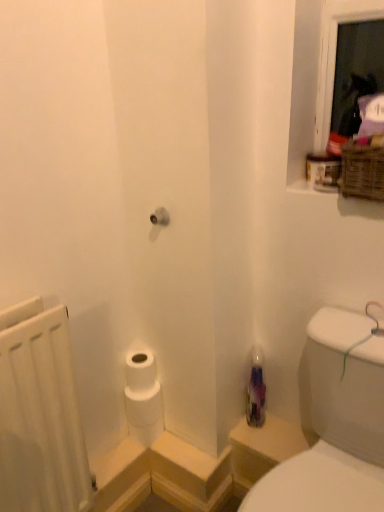
Question: In the image, is transparent plastic bottle at lower right positioned in front of or behind white matte radiator at left?

Choices:
 (A) front
 (B) behind

Answer: (A)

Question: From their relative heights in the image, would you say transparent plastic bottle at lower right is taller or shorter than white matte radiator at left?

Choices:
 (A) short
 (B) tall

Answer: (B)

Question: Which object is positioned closest to the woven brown basket at upper right?

Choices:
 (A) white matte radiator at left
 (B) transparent plastic bottle at lower right
 (C) translucent purple bottle at lower right
 (D) white matte toilet paper at lower left

Answer: (B)

Question: Which object is positioned farthest from the translucent purple bottle at lower right?

Choices:
 (A) white matte toilet paper at lower left
 (B) white matte radiator at left
 (C) woven brown basket at upper right
 (D) transparent plastic bottle at lower right

Answer: (C)